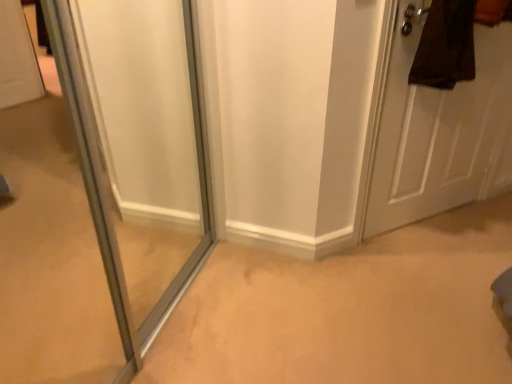
The image size is (512, 384). Describe the element at coordinates (348, 310) in the screenshot. I see `beige carpet at center` at that location.

Find the location of a particular element. This screenshot has width=512, height=384. beige carpet at center is located at coordinates (348, 310).

You are a GUI agent. You are given a task and a screenshot of the screen. Output one action in this format:
    pyautogui.click(x=<x>, y=<y>)
    Task: Click on the beige carpet at center
    
    Given the screenshot: What is the action you would take?
    pyautogui.click(x=348, y=310)